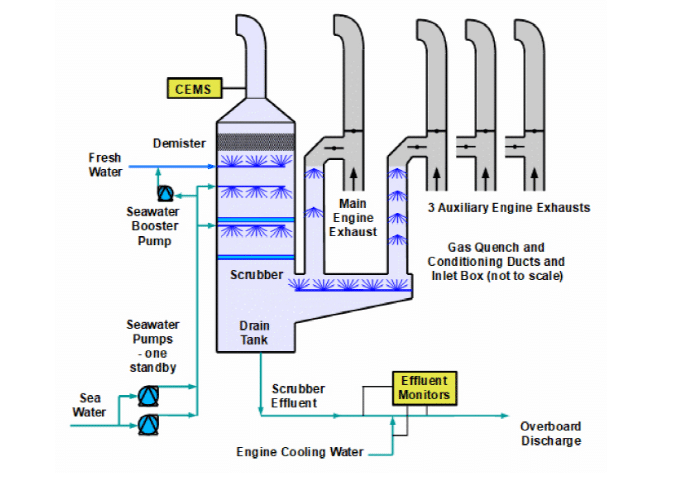
Where is `shower`? The height and width of the screenshot is (484, 688). shower is located at coordinates (255, 226).